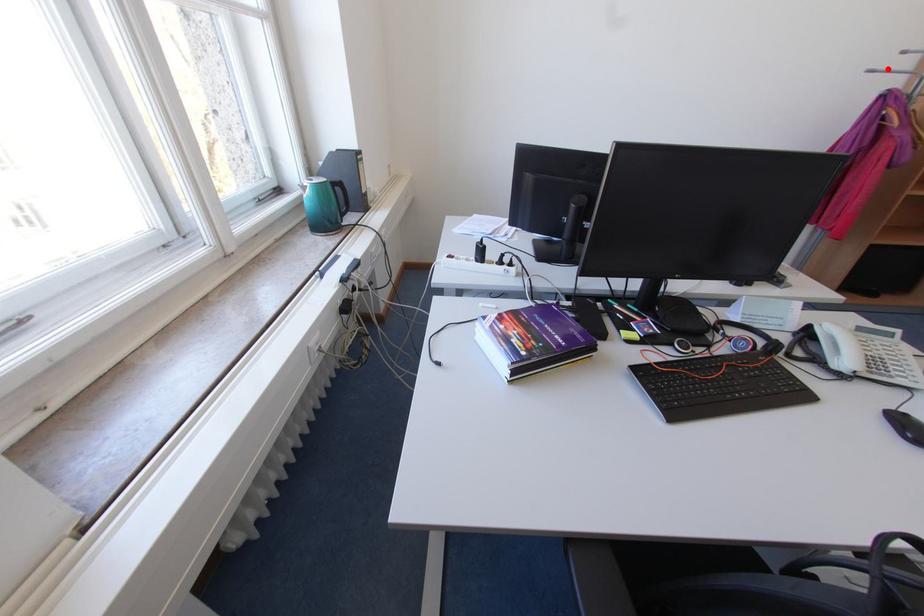
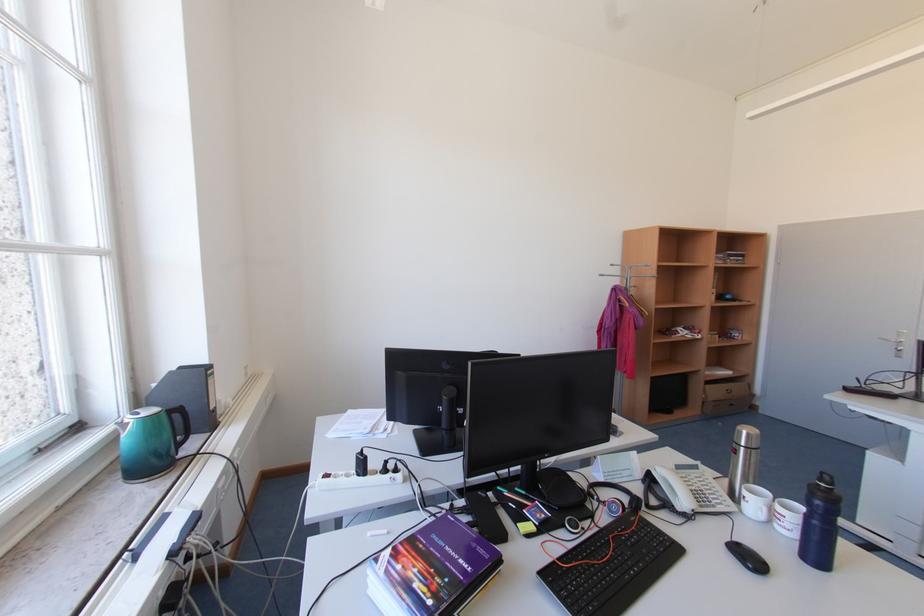
Question: I am providing you with two images of the same scene from different viewpoints. A red point is shown in image1. For the corresponding object point in image2, is it positioned nearer or farther from the camera?

Choices:
 (A) Nearer
 (B) Farther

Answer: (A)